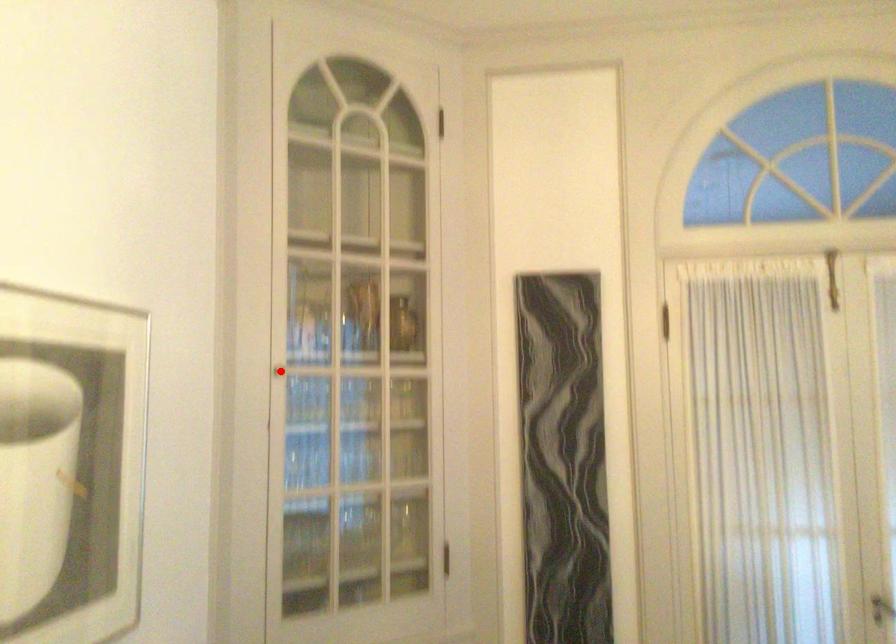
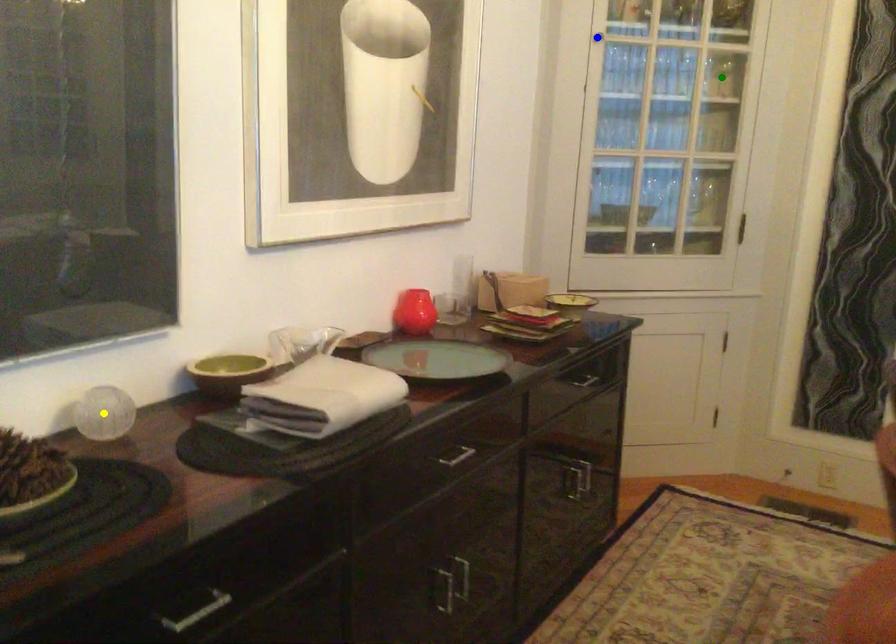
Question: I am providing you with two images of the same scene from different viewpoints. A red point is marked on the first image. You are given multiple points on the second image. In image 2, which mark is for the same physical point as the one in image 1?

Choices:
 (A) yellow point
 (B) green point
 (C) blue point

Answer: (C)